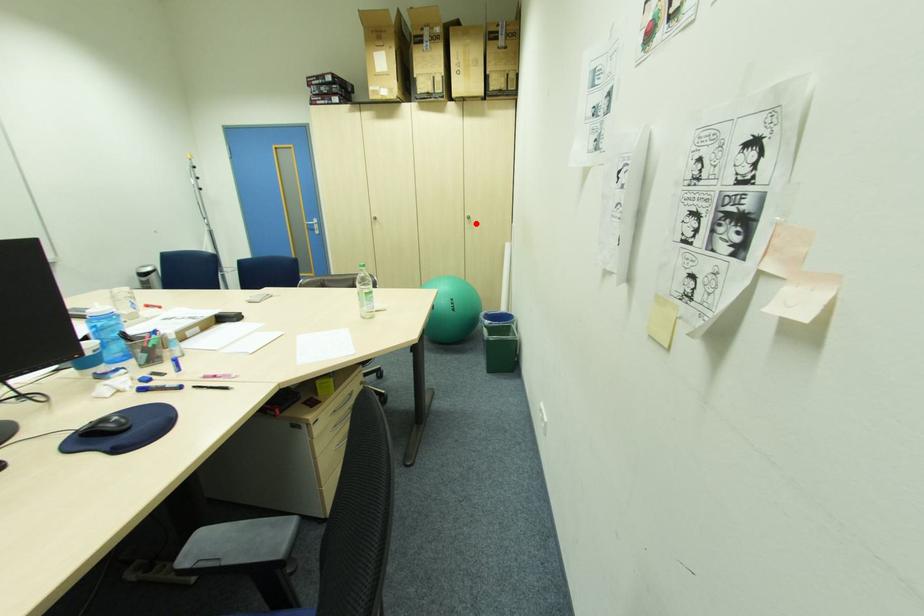
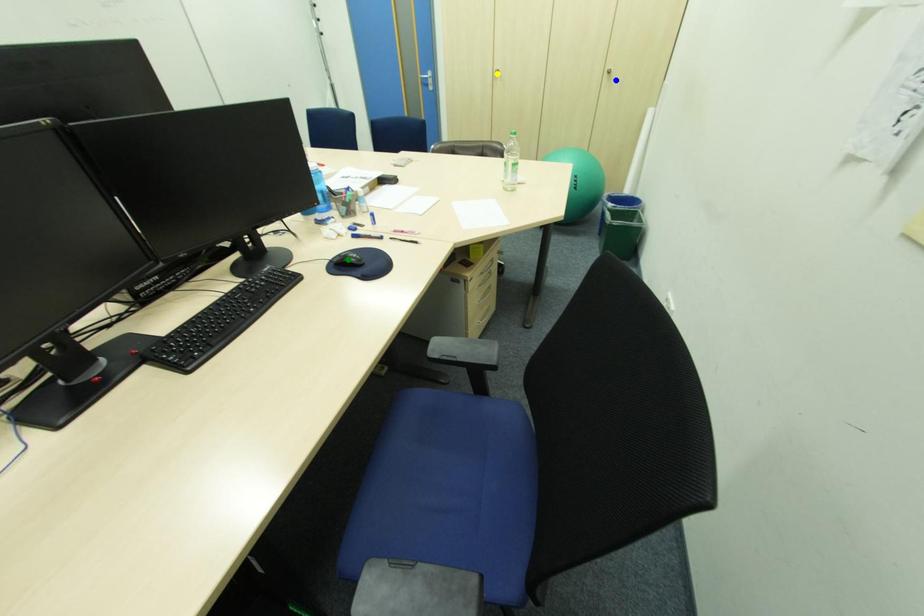
Question: I am providing you with two images of the same scene from different viewpoints. A red point is marked on the first image. You are given multiple points on the second image. In image 2, which mark is for the same physical point as the one in image 1?

Choices:
 (A) yellow point
 (B) green point
 (C) blue point

Answer: (C)